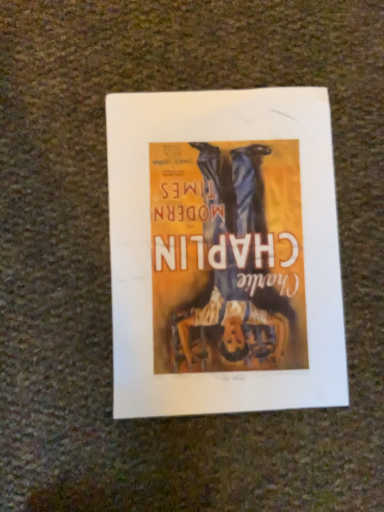
What is the approximate width of matte paper poster at center?

matte paper poster at center is 11.90 inches in width.

This screenshot has height=512, width=384. What do you see at coordinates (224, 252) in the screenshot? I see `matte paper poster at center` at bounding box center [224, 252].

Locate an element on the screen. This screenshot has width=384, height=512. matte paper poster at center is located at coordinates (224, 252).

Image resolution: width=384 pixels, height=512 pixels. Find the location of `matte paper poster at center`. matte paper poster at center is located at coordinates (224, 252).